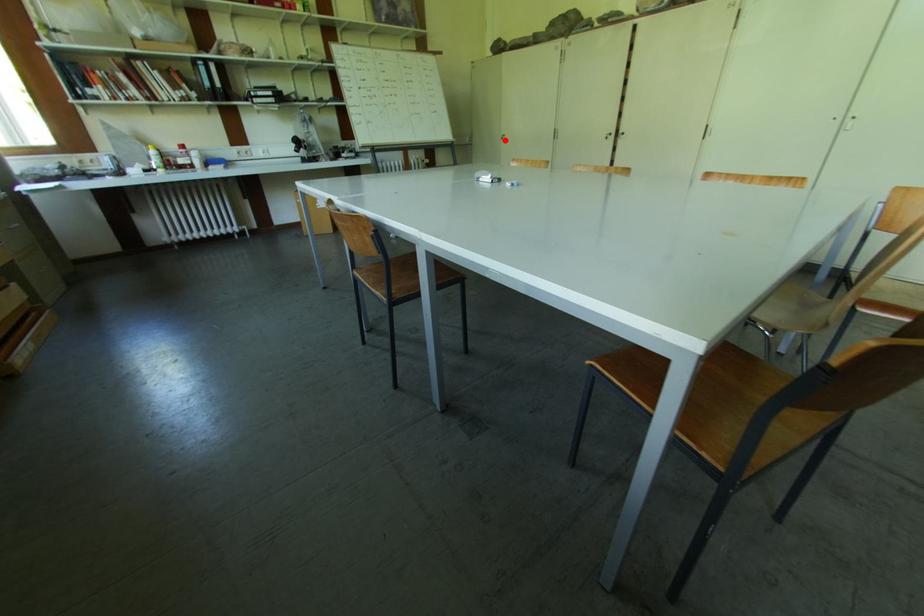
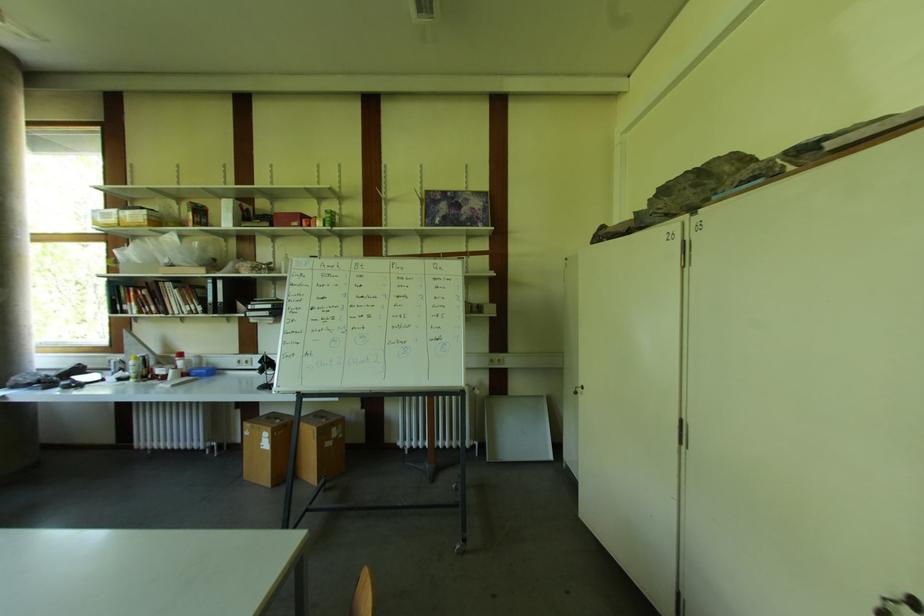
In the second image, find the point that corresponds to the highlighted location in the first image.

(578, 395)